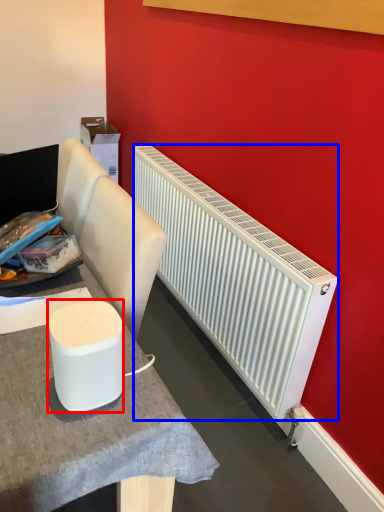
Question: Which of the following is the farthest to the observer, appliance (highlighted by a red box) or radiator (highlighted by a blue box)?

Choices:
 (A) appliance
 (B) radiator

Answer: (B)